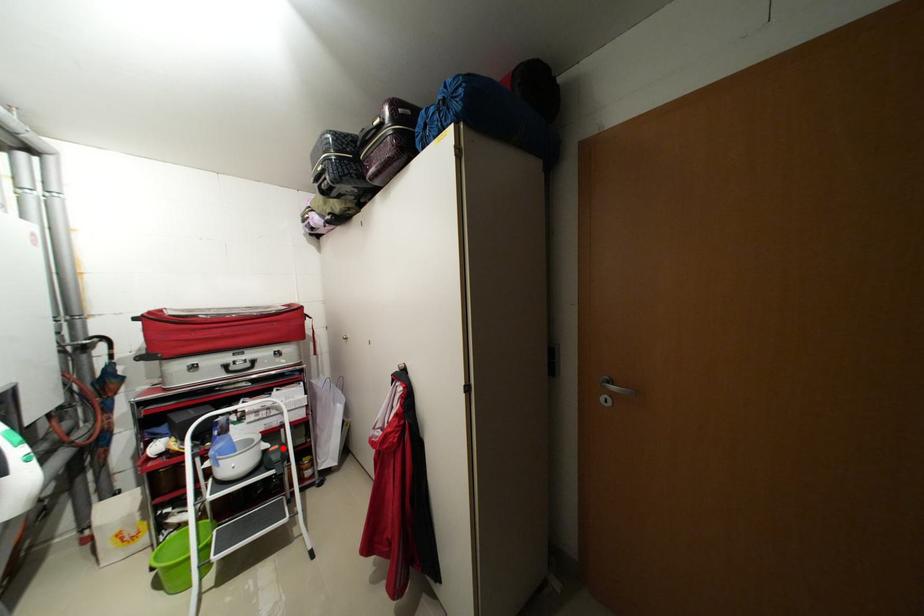
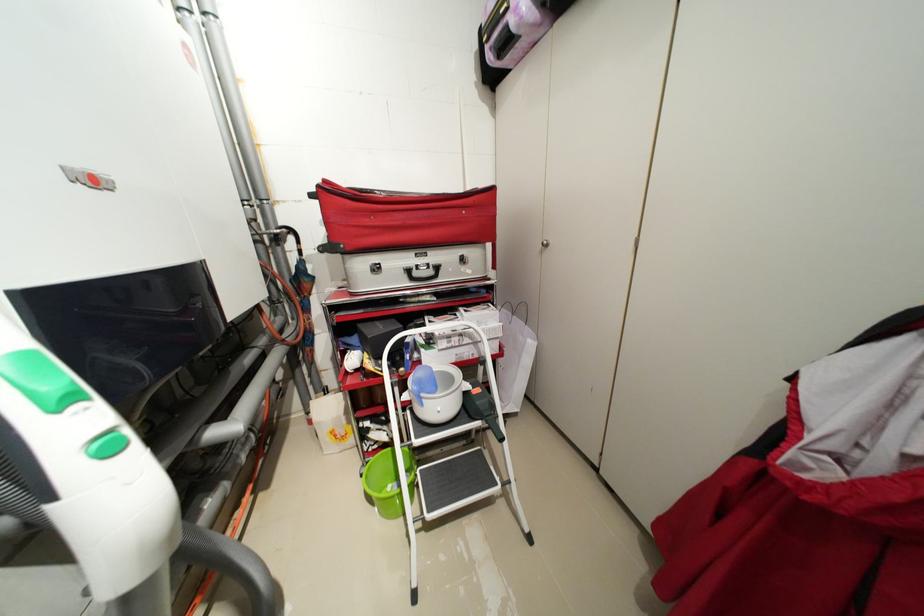
Question: I am providing you with two images of the same scene from different viewpoints. Image1 has a red point marked. In image2, the corresponding 3D location appears at what relative position? Reply with the corresponding letter.

Choices:
 (A) Closer
 (B) Farther

Answer: (B)